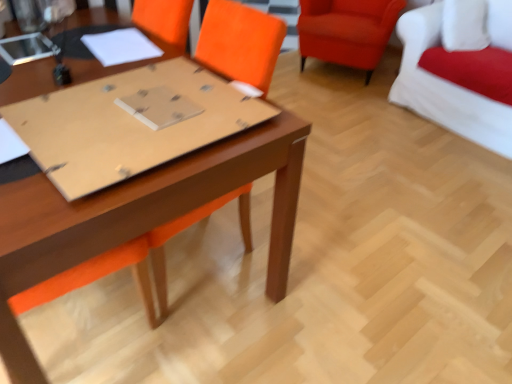
This screenshot has width=512, height=384. What do you see at coordinates (445, 88) in the screenshot?
I see `white fabric couch at upper right, placed as the first chair when sorted from right to left` at bounding box center [445, 88].

Looking at this image, measure the distance between point (252, 143) and camera.

A distance of 1.07 meters exists between point (252, 143) and camera.

What is the approximate height of velvet orange armchair at upper right, positioned as the first chair in left-to-right order?

velvet orange armchair at upper right, positioned as the first chair in left-to-right order, is 25.84 inches in height.

In order to click on velvet orange armchair at upper right, positioned as the 2th chair in right-to-left order in this screenshot , I will do `click(347, 31)`.

The width and height of the screenshot is (512, 384). I want to click on matte cardboard at center, so click(127, 124).

Who is taller, matte cardboard at center or velvet orange armchair at upper right, positioned as the 2th chair in right-to-left order?

Standing taller between the two is velvet orange armchair at upper right, positioned as the 2th chair in right-to-left order.

Who is bigger, matte cardboard at center or velvet orange armchair at upper right, positioned as the first chair in left-to-right order?

velvet orange armchair at upper right, positioned as the first chair in left-to-right order, is bigger.

Measure the distance from matte cardboard at center to velvet orange armchair at upper right, positioned as the first chair in left-to-right order.

The distance of matte cardboard at center from velvet orange armchair at upper right, positioned as the first chair in left-to-right order, is 2.24 meters.

Relative to velvet orange armchair at upper right, positioned as the first chair in left-to-right order, is matte cardboard at center in front or behind?

Visually, matte cardboard at center is located in front of velvet orange armchair at upper right, positioned as the first chair in left-to-right order.

How many degrees apart are the facing directions of velvet orange armchair at upper right, positioned as the 2th chair in right-to-left order, and matte cardboard at center?

There is a 26.1-degree angle between the facing directions of velvet orange armchair at upper right, positioned as the 2th chair in right-to-left order, and matte cardboard at center.

From the picture: Could you tell me if velvet orange armchair at upper right, positioned as the 2th chair in right-to-left order, is turned towards matte cardboard at center?

Yes, velvet orange armchair at upper right, positioned as the 2th chair in right-to-left order, faces towards matte cardboard at center.

From the image's perspective, is velvet orange armchair at upper right, positioned as the first chair in left-to-right order, above matte cardboard at center?

Indeed, from the image's perspective, velvet orange armchair at upper right, positioned as the first chair in left-to-right order, is shown above matte cardboard at center.

Is white paper at center at the back of matte brown table at center?

No, matte brown table at center's orientation is not away from white paper at center.

Consider the image. From the image's perspective, is matte brown table at center under white paper at center?

Yes, from the image's perspective, matte brown table at center is beneath white paper at center.

Is matte brown table at center shorter than white paper at center?

No, matte brown table at center is not shorter than white paper at center.

Measure the distance between matte brown table at center and white paper at center.

matte brown table at center is 29.14 inches from white paper at center.

Does white paper at center have a lesser width compared to matte brown table at center?

Correct, the width of white paper at center is less than that of matte brown table at center.

Which is correct: white paper at center is inside matte brown table at center, or outside of it?

white paper at center is not inside matte brown table at center, it's outside.

From the image's perspective, is white paper at center under matte brown table at center?

No, from the image's perspective, white paper at center is not below matte brown table at center.

The height and width of the screenshot is (384, 512). I want to click on notebook that is above the matte brown table at center (from a real-world perspective), so click(x=121, y=46).

Is white fabric couch at upper right, placed as the first chair when sorted from right to left, completely or partially inside white paper at center?

No.

Can you confirm if white paper at center is shorter than white fabric couch at upper right, placed as the first chair when sorted from right to left?

Yes, white paper at center is shorter than white fabric couch at upper right, placed as the first chair when sorted from right to left.

Which is closer to the camera, (100,55) or (484,129)?

Point (100,55)

Which of these two, matte cardboard at center or white paper at center, stands shorter?

white paper at center is shorter.

From the image's perspective, is matte cardboard at center under white paper at center?

Yes.

The image size is (512, 384). I want to click on notebook that is above the matte cardboard at center (from the image's perspective), so (x=121, y=46).

Considering the points (124, 168) and (83, 37), which point is behind, point (124, 168) or point (83, 37)?

The point (83, 37) is behind.

Is matte cardboard at center aimed at matte brown table at center?

No, matte cardboard at center does not turn towards matte brown table at center.

Considering the sizes of objects matte cardboard at center and matte brown table at center in the image provided, who is taller, matte cardboard at center or matte brown table at center?

matte brown table at center.

Which is in front, point (162, 129) or point (89, 256)?

Positioned in front is point (89, 256).

How far apart are matte cardboard at center and matte brown table at center?

A distance of 7.16 inches exists between matte cardboard at center and matte brown table at center.

This screenshot has width=512, height=384. Identify the location of cardboard lying below the velvet orange armchair at upper right, positioned as the first chair in left-to-right order (from the image's perspective). (127, 124).

Where is `the 1st chair counting from the right of the matte cardboard at center`? The height and width of the screenshot is (384, 512). the 1st chair counting from the right of the matte cardboard at center is located at coordinates (347, 31).

Which object lies nearer to the anchor point matte brown table at center, velvet orange armchair at upper right, positioned as the first chair in left-to-right order, or white paper at center?

Among the two, white paper at center is located nearer to matte brown table at center.

Considering their positions, is white fabric couch at upper right, marked as the second chair in a left-to-right arrangement, positioned further to white paper at center than matte cardboard at center?

The object further to white paper at center is white fabric couch at upper right, marked as the second chair in a left-to-right arrangement.

Which object lies further to the anchor point white fabric couch at upper right, marked as the second chair in a left-to-right arrangement, velvet orange armchair at upper right, positioned as the 2th chair in right-to-left order, or white paper at center?

white paper at center.

Considering their positions, is matte brown table at center positioned further to velvet orange armchair at upper right, positioned as the first chair in left-to-right order, than matte cardboard at center?

matte cardboard at center is positioned further to the anchor velvet orange armchair at upper right, positioned as the first chair in left-to-right order.

Looking at the image, which one is located closer to matte cardboard at center, white fabric couch at upper right, marked as the second chair in a left-to-right arrangement, or velvet orange armchair at upper right, positioned as the first chair in left-to-right order?

Among the two, white fabric couch at upper right, marked as the second chair in a left-to-right arrangement, is located nearer to matte cardboard at center.

Based on their spatial positions, is matte cardboard at center or white paper at center further from velvet orange armchair at upper right, positioned as the first chair in left-to-right order?

Based on the image, matte cardboard at center appears to be further to velvet orange armchair at upper right, positioned as the first chair in left-to-right order.

Estimate the real-world distances between objects in this image. Which object is closer to white fabric couch at upper right, placed as the first chair when sorted from right to left, matte brown table at center or velvet orange armchair at upper right, positioned as the 2th chair in right-to-left order?

velvet orange armchair at upper right, positioned as the 2th chair in right-to-left order, lies closer to white fabric couch at upper right, placed as the first chair when sorted from right to left, than the other object.

Estimate the real-world distances between objects in this image. Which object is further from matte brown table at center, matte cardboard at center or velvet orange armchair at upper right, positioned as the 2th chair in right-to-left order?

velvet orange armchair at upper right, positioned as the 2th chair in right-to-left order, lies further to matte brown table at center than the other object.

You are a GUI agent. You are given a task and a screenshot of the screen. Output one action in this format:
    pyautogui.click(x=<x>, y=<y>)
    Task: Click on the cardboard located between matte brown table at center and white paper at center in the depth direction
    The height and width of the screenshot is (384, 512).
    Given the screenshot: What is the action you would take?
    pyautogui.click(x=127, y=124)

Where is `cardboard located between white paper at center and white fabric couch at upper right, marked as the second chair in a left-to-right arrangement, in the left-right direction`? This screenshot has width=512, height=384. cardboard located between white paper at center and white fabric couch at upper right, marked as the second chair in a left-to-right arrangement, in the left-right direction is located at coordinates (127, 124).

At what (x,y) coordinates should I click in order to perform the action: click on chair between matte cardboard at center and velvet orange armchair at upper right, positioned as the 2th chair in right-to-left order, along the z-axis. Please return your answer as a coordinate pair (x, y). This screenshot has width=512, height=384. Looking at the image, I should click on (445, 88).

You are a GUI agent. You are given a task and a screenshot of the screen. Output one action in this format:
    pyautogui.click(x=<x>, y=<y>)
    Task: Click on the chair between matte brown table at center and white fabric couch at upper right, marked as the second chair in a left-to-right arrangement
    The height and width of the screenshot is (384, 512).
    Given the screenshot: What is the action you would take?
    pyautogui.click(x=347, y=31)